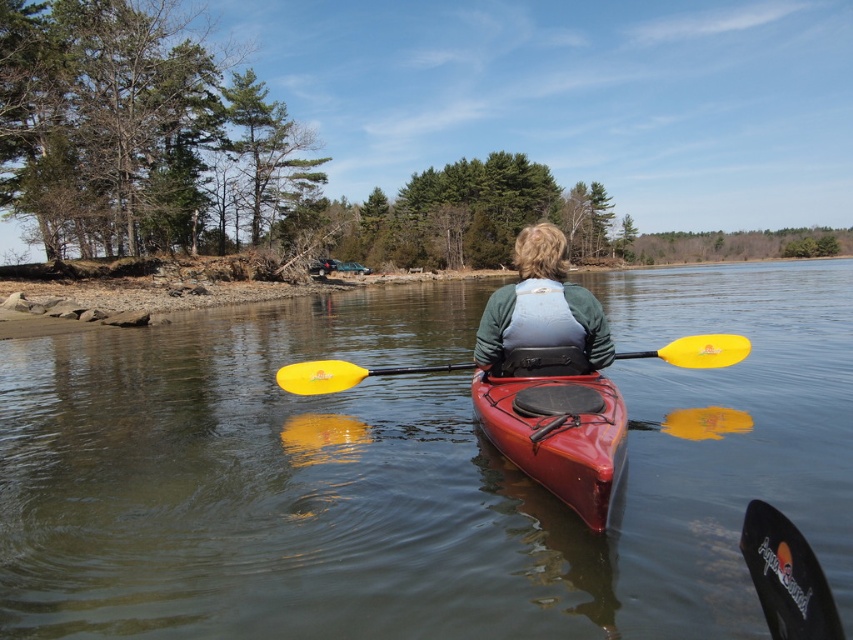
Question: Is matte red kayak at center in front of matte green vest at center?

Choices:
 (A) yes
 (B) no

Answer: (A)

Question: From the image, what is the correct spatial relationship of clear water at center in relation to matte green vest at center?

Choices:
 (A) right
 (B) left

Answer: (A)

Question: Which point is farther to the camera?

Choices:
 (A) yellow matte paddle at center
 (B) clear water at center
 (C) matte red kayak at center

Answer: (A)

Question: Among these objects, which one is farthest from the camera?

Choices:
 (A) matte red kayak at center
 (B) matte green vest at center
 (C) yellow matte paddle at center

Answer: (C)

Question: Which point is farther to the camera?

Choices:
 (A) matte red kayak at center
 (B) matte green vest at center

Answer: (B)

Question: Is clear water at center thinner than yellow matte paddle at center?

Choices:
 (A) no
 (B) yes

Answer: (A)